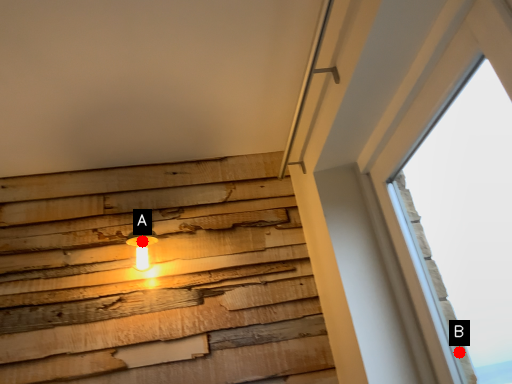
Question: Two points are circled on the image, labeled by A and B beside each circle. Which point is farther to the camera?

Choices:
 (A) A is further
 (B) B is further

Answer: (A)